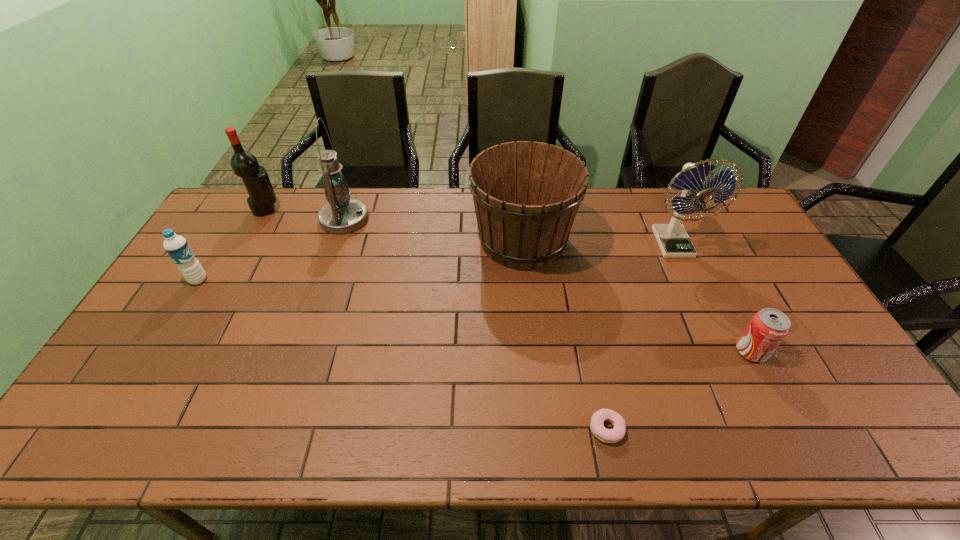
This screenshot has width=960, height=540. What are the coordinates of `wine bucket situated at the far edge` in the screenshot? It's located at (526, 195).

The image size is (960, 540). Find the location of `object at the near edge`. object at the near edge is located at coordinates (614, 435).

Where is `wine bottle that is at the left edge`? The height and width of the screenshot is (540, 960). wine bottle that is at the left edge is located at coordinates (244, 164).

Locate an element on the screen. water bottle at the left edge is located at coordinates (176, 246).

This screenshot has height=540, width=960. Find the location of `object that is at the far left corner`. object that is at the far left corner is located at coordinates (244, 164).

You are a GUI agent. You are given a task and a screenshot of the screen. Output one action in this format:
    pyautogui.click(x=<x>, y=<y>)
    Task: Click on the vacant position at the far edge of the desktop
    The width and height of the screenshot is (960, 540).
    Given the screenshot: What is the action you would take?
    pyautogui.click(x=626, y=201)

In the image, there is a desktop. In order to click on free region at the near edge in this screenshot , I will do `click(693, 415)`.

This screenshot has height=540, width=960. In order to click on free space at the left edge of the desktop in this screenshot , I will do `click(150, 314)`.

You are a GUI agent. You are given a task and a screenshot of the screen. Output one action in this format:
    pyautogui.click(x=<x>, y=<y>)
    Task: Click on the free region at the right edge
    
    Given the screenshot: What is the action you would take?
    pyautogui.click(x=819, y=410)

Locate an element on the screen. vacant space at the near right corner of the desktop is located at coordinates tap(837, 424).